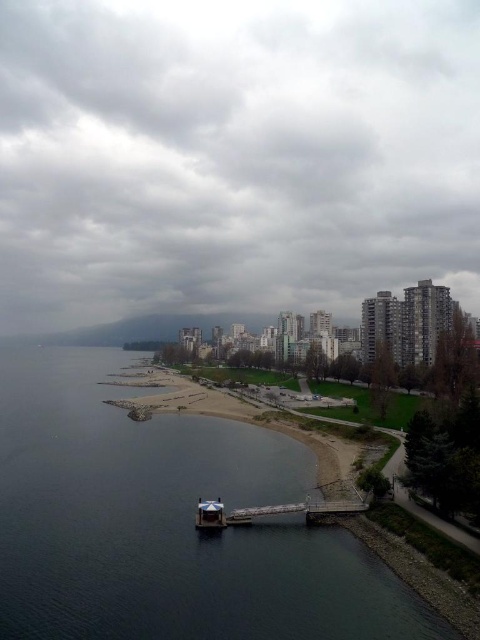
You are a photographer wanting to capture the waterfront area. You notice both the dark gray concrete pier at lower left and the wooden pier at lower center. Which pier should you choose to get a higher vantage point for your photos?

The dark gray concrete pier at lower left has a greater height compared to the wooden pier at lower center, so you should choose the dark gray concrete pier at lower left to get a higher vantage point for your photos.